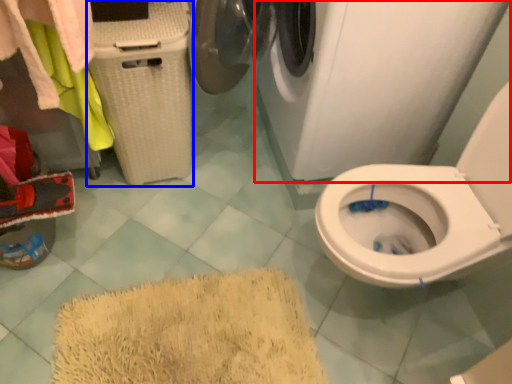
Question: Which of the following is the closest to the observer, washing machine (highlighted by a red box) or laundry basket (highlighted by a blue box)?

Choices:
 (A) washing machine
 (B) laundry basket

Answer: (A)